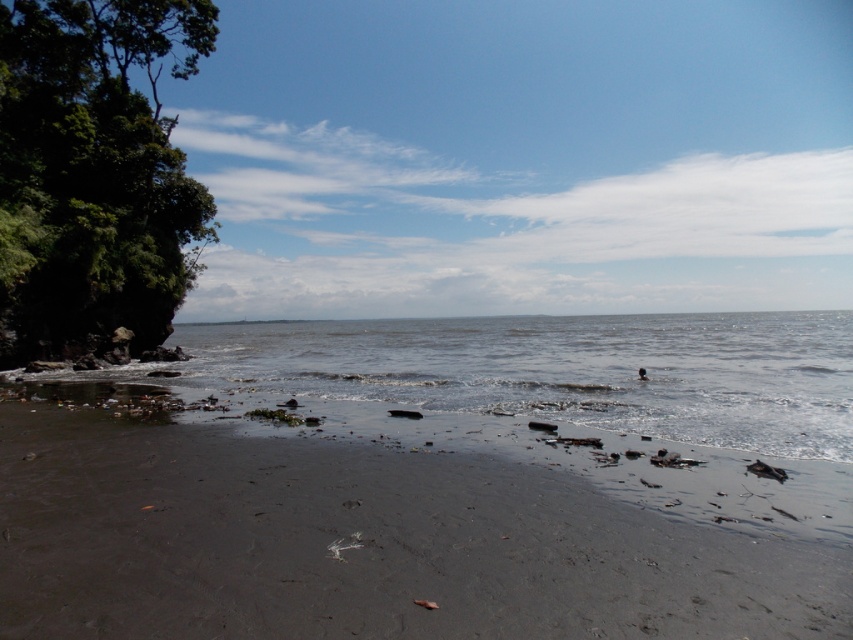
Question: Which point is closer to the camera?

Choices:
 (A) (42, 509)
 (B) (142, 243)

Answer: (A)

Question: Is dark gray sand at lower center below green leafy tree at left?

Choices:
 (A) no
 (B) yes

Answer: (B)

Question: Which object appears farthest from the camera in this image?

Choices:
 (A) green leafy tree at left
 (B) dark gray sand at lower center

Answer: (A)

Question: Can you confirm if dark gray sand at lower center is positioned above green leafy tree at left?

Choices:
 (A) yes
 (B) no

Answer: (B)

Question: Can you confirm if dark gray sand at lower center is positioned to the left of green leafy tree at left?

Choices:
 (A) yes
 (B) no

Answer: (B)